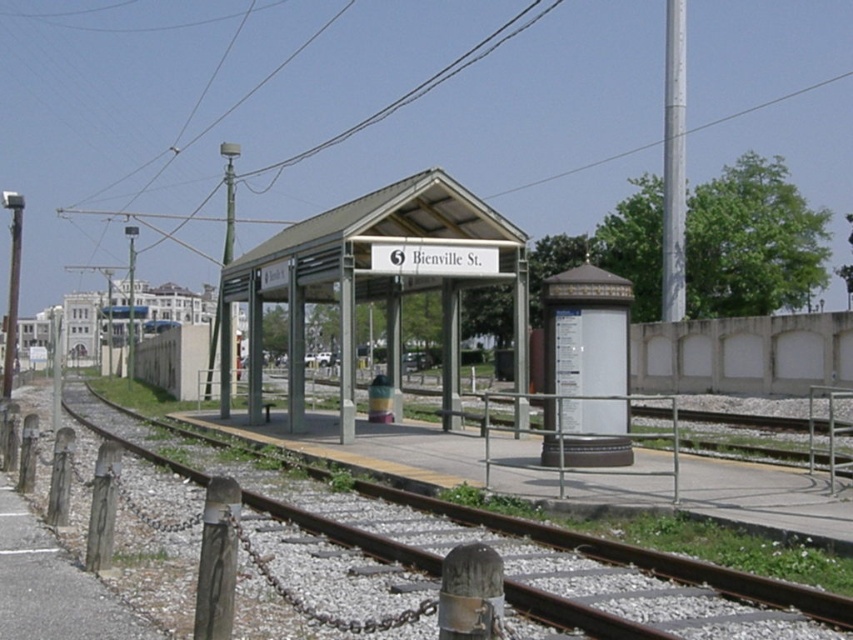
Question: Where is metallic gray bus stop at center located in relation to white painted metal pole at upper right in the image?

Choices:
 (A) right
 (B) left

Answer: (B)

Question: Is metallic gray bus stop at center in front of white painted metal pole at upper right?

Choices:
 (A) yes
 (B) no

Answer: (A)

Question: Which of these objects is positioned farthest from the white painted metal pole at upper right?

Choices:
 (A) metallic gray bus stop at center
 (B) rusty metal train track at lower left
 (C) green matte pole at upper center

Answer: (B)

Question: Which object is the farthest from the white painted metal pole at upper right?

Choices:
 (A) green matte pole at upper center
 (B) rusty metal train track at lower left
 (C) metallic gray bus stop at center

Answer: (B)

Question: Which point is farther to the camera?

Choices:
 (A) green matte pole at upper center
 (B) rusty metal train track at lower left
 (C) metallic gray bus stop at center

Answer: (A)

Question: Is white painted metal pole at upper right below green matte pole at upper center?

Choices:
 (A) yes
 (B) no

Answer: (B)